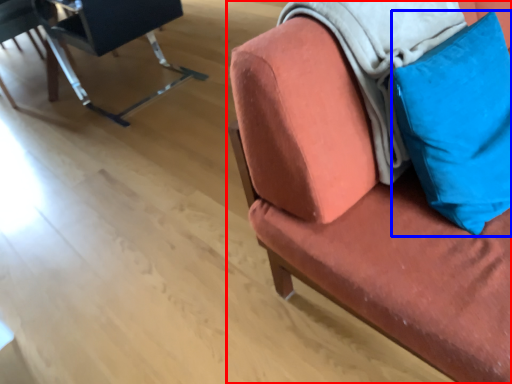
Question: Which point is further to the camera, chair (highlighted by a red box) or pillow (highlighted by a blue box)?

Choices:
 (A) chair
 (B) pillow

Answer: (B)